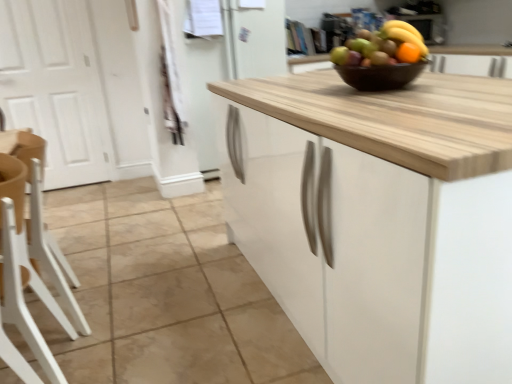
Question: Does natural stone tile at center have a larger size compared to yellow matte bananas at upper center?

Choices:
 (A) yes
 (B) no

Answer: (A)

Question: From a real-world perspective, is natural stone tile at center physically above yellow matte bananas at upper center?

Choices:
 (A) yes
 (B) no

Answer: (B)

Question: Considering the relative positions of natural stone tile at center and yellow matte bananas at upper center in the image provided, is natural stone tile at center in front of yellow matte bananas at upper center?

Choices:
 (A) no
 (B) yes

Answer: (B)

Question: Does natural stone tile at center have a smaller size compared to yellow matte bananas at upper center?

Choices:
 (A) no
 (B) yes

Answer: (A)

Question: Is natural stone tile at center positioned far away from yellow matte bananas at upper center?

Choices:
 (A) no
 (B) yes

Answer: (B)

Question: Is natural stone tile at center shorter than yellow matte bananas at upper center?

Choices:
 (A) yes
 (B) no

Answer: (A)

Question: Can you confirm if orange matte grapefruit at upper center is bigger than yellow matte bananas at upper center?

Choices:
 (A) no
 (B) yes

Answer: (A)

Question: From the image's perspective, is orange matte grapefruit at upper center above yellow matte bananas at upper center?

Choices:
 (A) yes
 (B) no

Answer: (B)

Question: Is yellow matte bananas at upper center surrounded by orange matte grapefruit at upper center?

Choices:
 (A) yes
 (B) no

Answer: (B)

Question: Is orange matte grapefruit at upper center oriented away from yellow matte bananas at upper center?

Choices:
 (A) no
 (B) yes

Answer: (A)

Question: Is orange matte grapefruit at upper center completely or partially outside of yellow matte bananas at upper center?

Choices:
 (A) yes
 (B) no

Answer: (A)

Question: Is orange matte grapefruit at upper center to the left of yellow matte bananas at upper center from the viewer's perspective?

Choices:
 (A) yes
 (B) no

Answer: (A)

Question: Considering the relative positions of orange matte grapefruit at upper center and white wood chair at left, which is the 2th chair from front to back, in the image provided, is orange matte grapefruit at upper center to the left of white wood chair at left, which is the 2th chair from front to back, from the viewer's perspective?

Choices:
 (A) yes
 (B) no

Answer: (B)